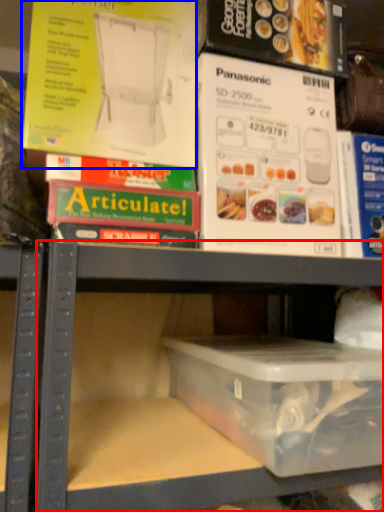
Question: Which of the following is the farthest to the observer, shelf (highlighted by a red box) or paperback book (highlighted by a blue box)?

Choices:
 (A) shelf
 (B) paperback book

Answer: (B)